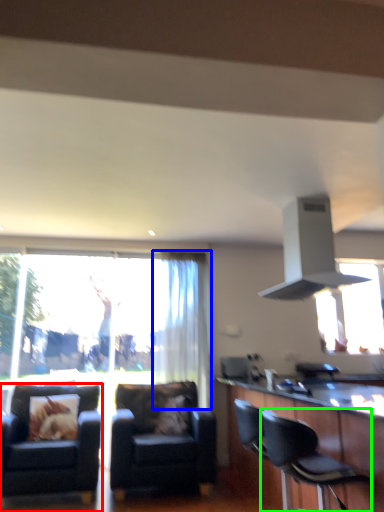
Question: Which is nearer to the chair (highlighted by a red box)? curtain (highlighted by a blue box) or chair (highlighted by a green box).

Choices:
 (A) curtain
 (B) chair

Answer: (A)